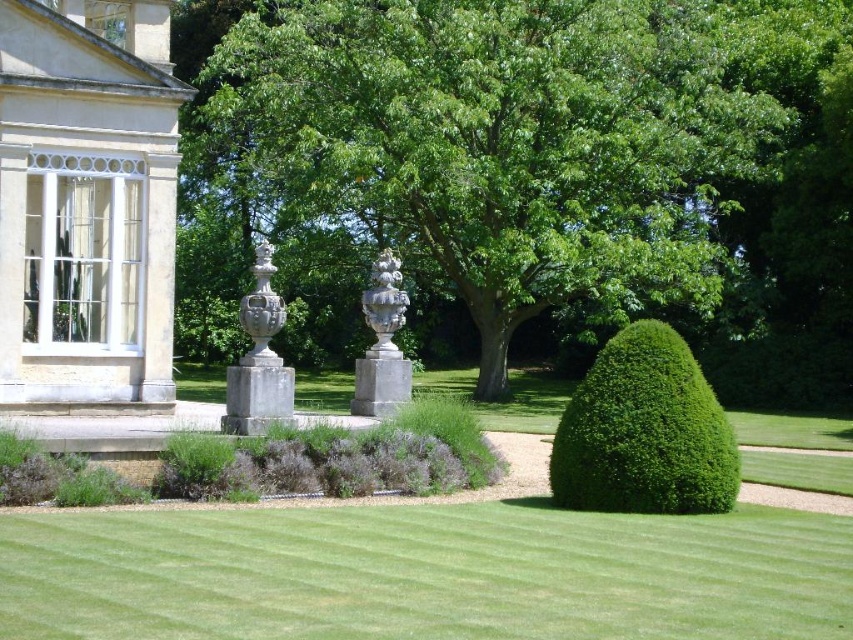
Based on the photo, does green smooth lawn at center appear on the right side of white marble vase at center?

Indeed, green smooth lawn at center is positioned on the right side of white marble vase at center.

Is point (461, 536) positioned behind point (265, 253)?

That is False.

You are a GUI agent. You are given a task and a screenshot of the screen. Output one action in this format:
    pyautogui.click(x=<x>, y=<y>)
    Task: Click on the green smooth lawn at center
    Image resolution: width=853 pixels, height=640 pixels.
    Given the screenshot: What is the action you would take?
    pyautogui.click(x=425, y=573)

Can you confirm if beige stone gazebo at upper left is positioned below white stone vase at center?

Correct, beige stone gazebo at upper left is located below white stone vase at center.

This screenshot has width=853, height=640. In order to click on beige stone gazebo at upper left in this screenshot , I will do `click(86, 205)`.

Is point (370, 508) closer to camera compared to point (607, 502)?

That is False.

The width and height of the screenshot is (853, 640). I want to click on green smooth lawn at center, so [x=425, y=573].

Does point (525, 618) lie behind point (575, 417)?

No, it is not.

Image resolution: width=853 pixels, height=640 pixels. I want to click on green smooth lawn at center, so click(x=425, y=573).